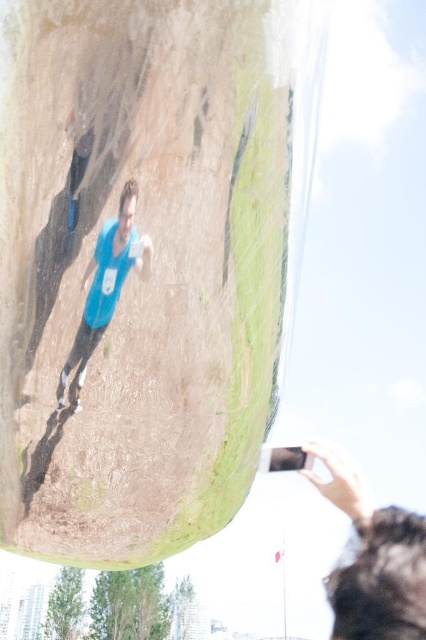
What do you see at coordinates (146, 262) in the screenshot? The image size is (426, 640). I see `transparent plastic bubble at center` at bounding box center [146, 262].

In the scene shown: Between transparent plastic bubble at center and blue fabric shirt at center, which one is positioned higher?

blue fabric shirt at center is higher up.

Does point (74, 176) lie in front of point (81, 378)?

That is True.

At what (x,y) coordinates should I click in order to perform the action: click on transparent plastic bubble at center. Please return your answer as a coordinate pair (x, y). Looking at the image, I should click on (146, 262).

Measure the distance between point (198, 324) and camera.

10.46 centimeters

Find the location of a particular element. The image size is (426, 640). transparent plastic bubble at center is located at coordinates (146, 262).

Is blue fabric shirt at lower right shorter than blue fabric shirt at center?

In fact, blue fabric shirt at lower right may be taller than blue fabric shirt at center.

Is blue fabric shirt at lower right thinner than blue fabric shirt at center?

Incorrect, blue fabric shirt at lower right's width is not less than blue fabric shirt at center's.

Is point (348, 608) closer to viewer compared to point (88, 314)?

No, it is not.

The width and height of the screenshot is (426, 640). Identify the location of blue fabric shirt at lower right. (374, 560).